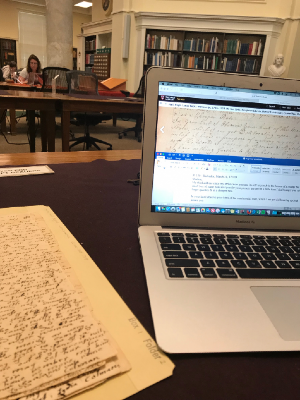
Identify the location of books. The height and width of the screenshot is (400, 300). (174, 45).